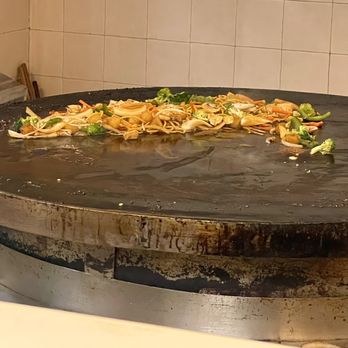
Locate an element on the screen. cream colored ledge is located at coordinates (65, 328), (96, 332).